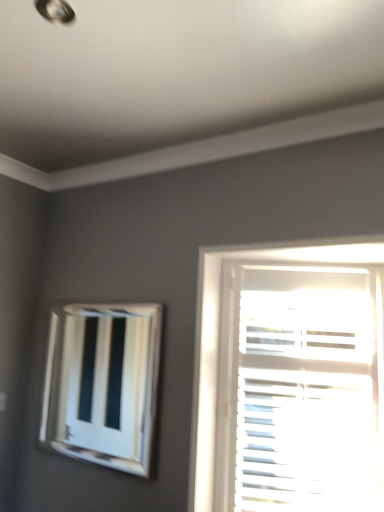
Question: From a real-world perspective, is white glossy vent at upper left physically located above or below white matte blinds at right?

Choices:
 (A) below
 (B) above

Answer: (B)

Question: Considering the positions of white glossy vent at upper left and white matte blinds at right in the image, is white glossy vent at upper left taller or shorter than white matte blinds at right?

Choices:
 (A) tall
 (B) short

Answer: (B)

Question: In the image, is white glossy vent at upper left positioned in front of or behind white matte blinds at right?

Choices:
 (A) behind
 (B) front

Answer: (A)

Question: Is white matte blinds at right situated inside white glossy vent at upper left or outside?

Choices:
 (A) outside
 (B) inside

Answer: (A)

Question: Is white matte blinds at right taller or shorter than white glossy vent at upper left?

Choices:
 (A) short
 (B) tall

Answer: (B)

Question: Relative to white glossy vent at upper left, is white matte blinds at right in front or behind?

Choices:
 (A) behind
 (B) front

Answer: (B)

Question: Is white matte blinds at right bigger or smaller than white glossy vent at upper left?

Choices:
 (A) big
 (B) small

Answer: (A)